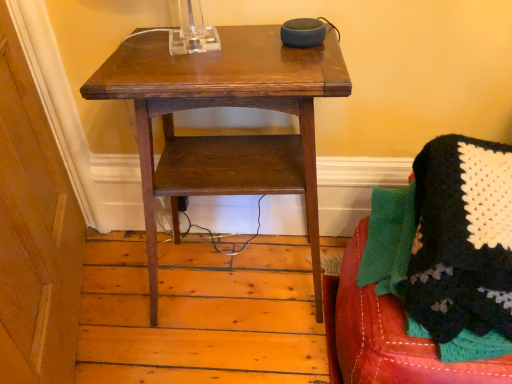
Find the location of a particular element. This screenshot has width=512, height=384. blank area beneath wooden table at center (from a real-world perspective) is located at coordinates (240, 272).